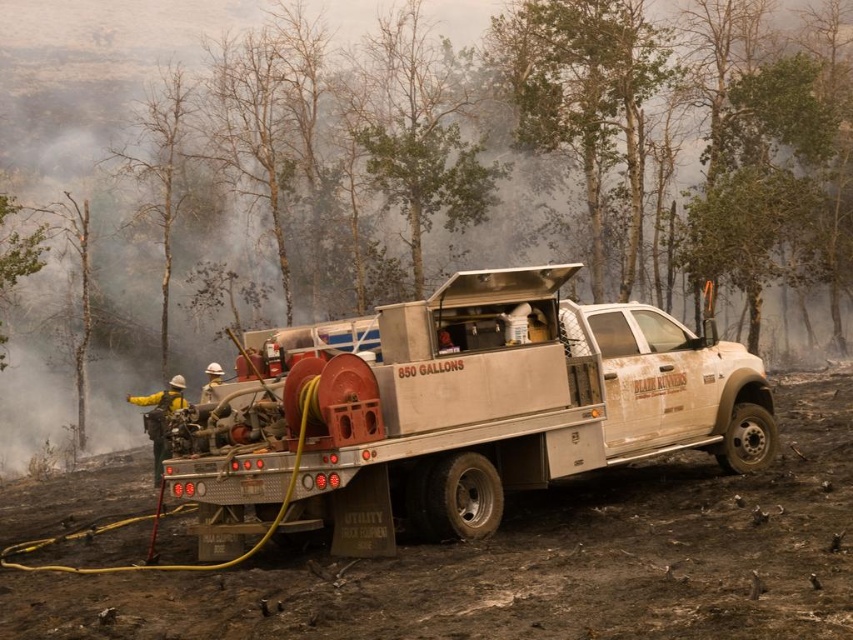
Who is shorter, green leafy tree at center or white matte utility truck at center?

white matte utility truck at center is shorter.

What do you see at coordinates (405, 177) in the screenshot?
I see `green leafy tree at center` at bounding box center [405, 177].

Between point (96, 416) and point (584, 445), which one is positioned in front?

Point (584, 445)

I want to click on green leafy tree at center, so click(x=405, y=177).

Is green leafy tree at center below yellow reflective jacket at center?

Incorrect, green leafy tree at center is not positioned below yellow reflective jacket at center.

The height and width of the screenshot is (640, 853). I want to click on green leafy tree at center, so coord(405,177).

Where is `green leafy tree at center`? green leafy tree at center is located at coordinates (405, 177).

Find the location of a particular element. The image size is (853, 640). green leafy tree at center is located at coordinates (405, 177).

At what (x,y) coordinates should I click in order to perform the action: click on white matte utility truck at center. Please return your answer as a coordinate pair (x, y). Looking at the image, I should click on (457, 412).